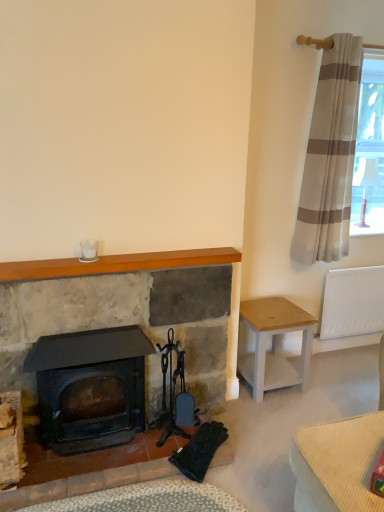
Locate an element on the screen. This screenshot has width=384, height=512. free space in front of matte black wood burning stove at center-left is located at coordinates tap(89, 480).